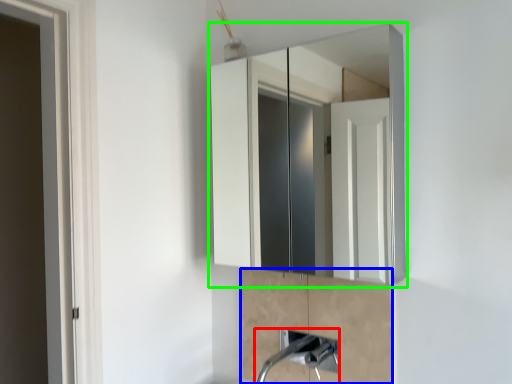
Question: Considering the real-world distances, which object is closest to plumbing fixture (highlighted by a red box)? cabinetry (highlighted by a blue box) or medicine cabinet (highlighted by a green box).

Choices:
 (A) cabinetry
 (B) medicine cabinet

Answer: (A)